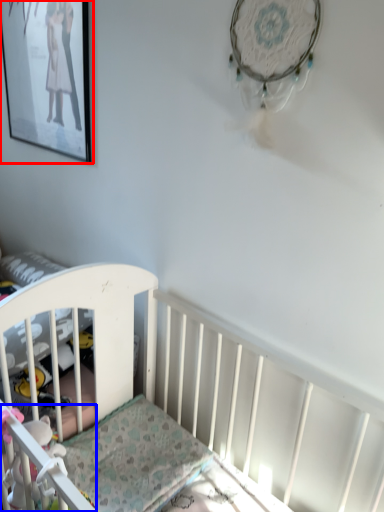
Question: Which object is further to the camera taking this photo, picture frame (highlighted by a red box) or toy (highlighted by a blue box)?

Choices:
 (A) picture frame
 (B) toy

Answer: (A)